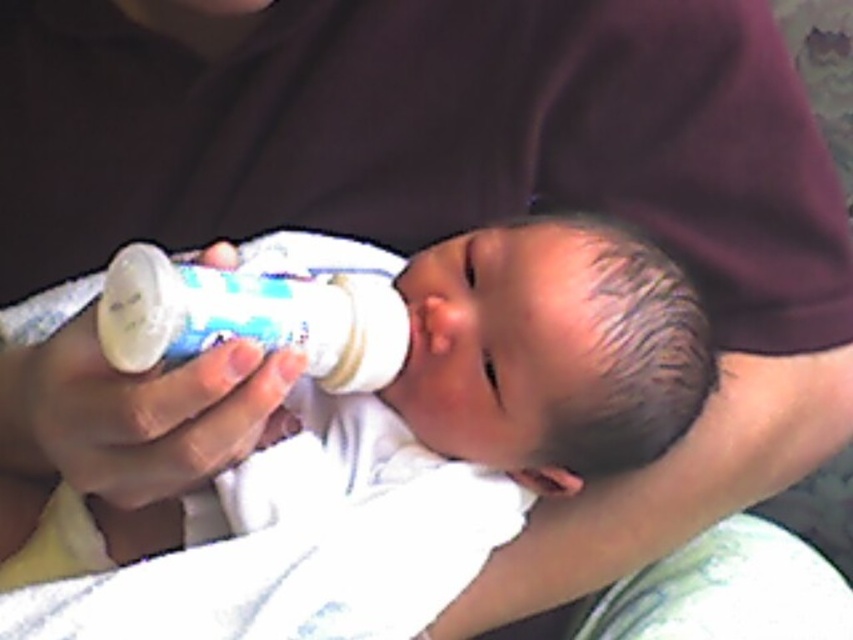
Question: Which object appears farthest from the camera in this image?

Choices:
 (A) white soft baby bottle at center
 (B) white plastic baby bottle at center

Answer: (A)

Question: Among these points, which one is farthest from the camera?

Choices:
 (A) (234, 284)
 (B) (480, 440)

Answer: (B)

Question: Does white soft baby bottle at center have a larger size compared to white plastic baby bottle at center?

Choices:
 (A) no
 (B) yes

Answer: (B)

Question: Does white soft baby bottle at center have a larger size compared to white plastic baby bottle at center?

Choices:
 (A) yes
 (B) no

Answer: (A)

Question: Can you confirm if white soft baby bottle at center is positioned above white plastic baby bottle at center?

Choices:
 (A) no
 (B) yes

Answer: (A)